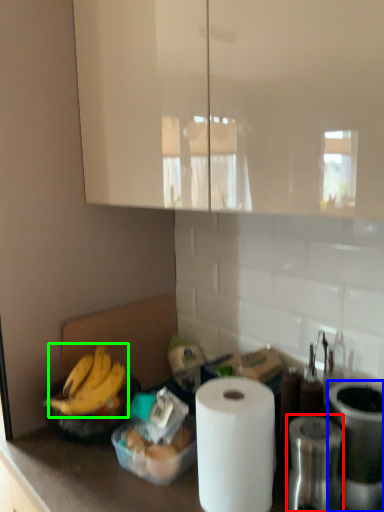
Question: Which is nearer to the appliance (highlighted by a red box)? appliance (highlighted by a blue box) or banana (highlighted by a green box).

Choices:
 (A) appliance
 (B) banana

Answer: (A)